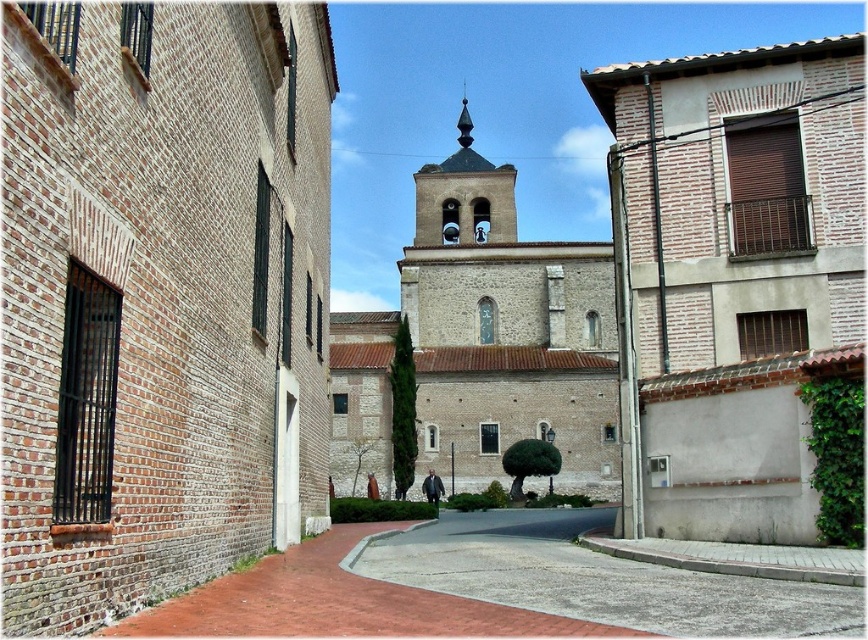
You are a tourist standing on the brick pavement at center and want to take a photo of the white brick church at center. Since the church is much taller than the brick pavement, will the entire church fit in your camera frame if you are standing on the pavement?

The white brick church at center is much taller than the brick pavement at center. Since the church is taller, it might not fit entirely within the camera frame when standing on the pavement, as the pavement is lower and the church is elevated. Adjust your position or use a wider lens for better framing.

You are a tourist standing on the brick pavement at center and looking towards the brown brick church at center. Which structure is taller?

The brown brick church at center is taller than the brick pavement at center.

Based on the photo, you are standing at the point with coordinates point (145, 19) and want to walk to the point (686, 572). Which direction should you move to get closer to your destination?

You should move backward because point (145, 19) is in front of point (686, 572), meaning your destination is behind you.